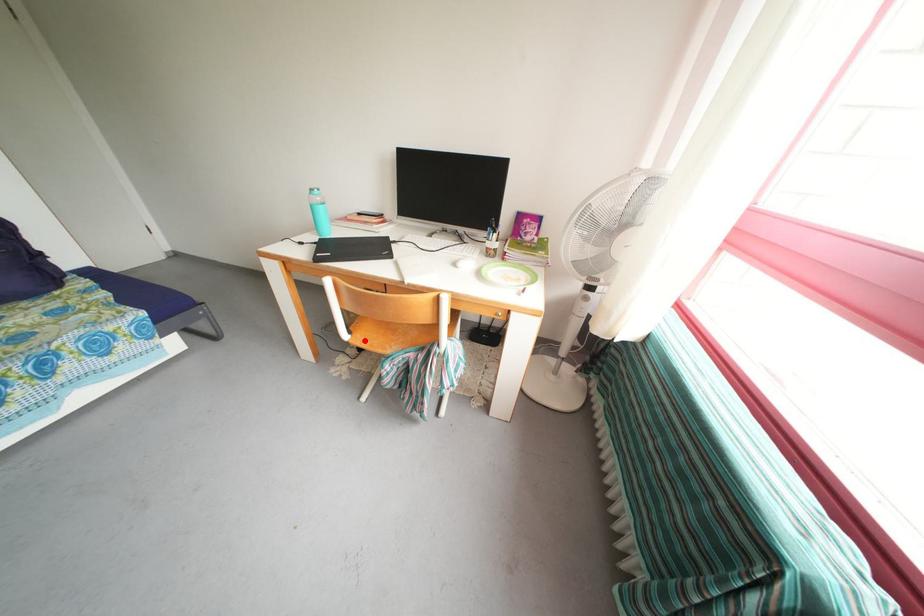
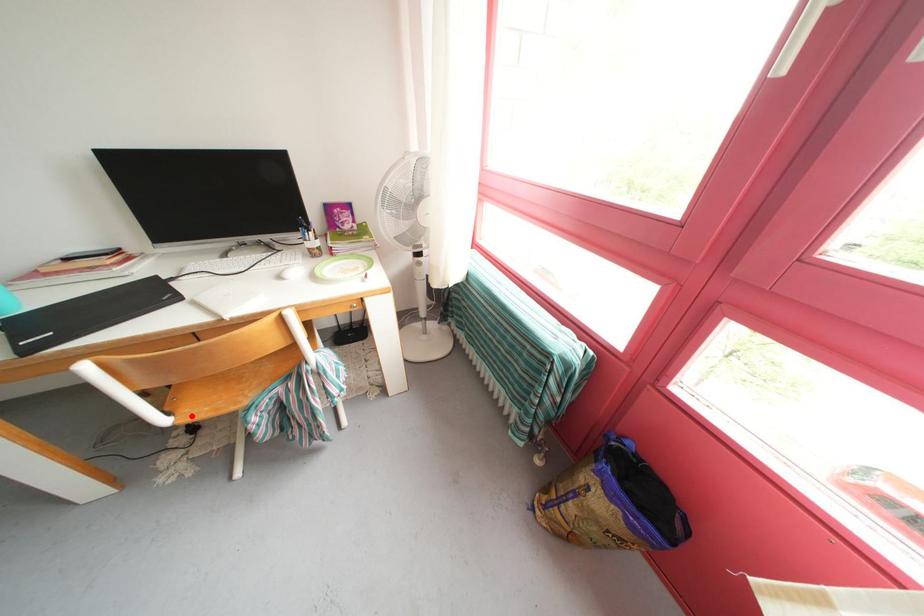
I am providing you with two images of the same scene from different viewpoints. A red point is marked on the first image and another point is marked on the second image. Are the points marked in image1 and image2 representing the same 3D position?

Yes